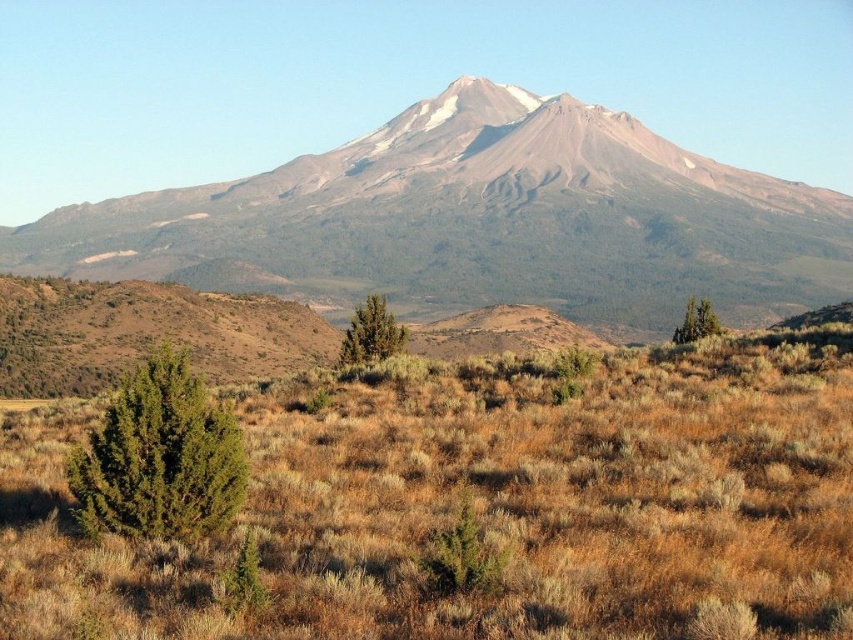
You are standing at the base of the mountain in the rugged landscape. You notice two points marked on the terrain. The first point is at coordinates point (x=161, y=531) and the second is at point (x=370, y=336). Which point is closer to you?

Point (x=161, y=531) is closer to the viewer than point (x=370, y=336).

You are a hiker planning to cross the arid terrain between the green textured bush at lower left and the green matte tree at center. Which of the two plants has a wider spread in terms of horizontal coverage?

The green textured bush at lower left has a wider spread than the green matte tree at center, as its width surpasses that of the tree.